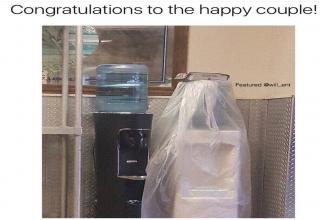
I want to click on likely water-dispenser brandname, so click(132, 159).